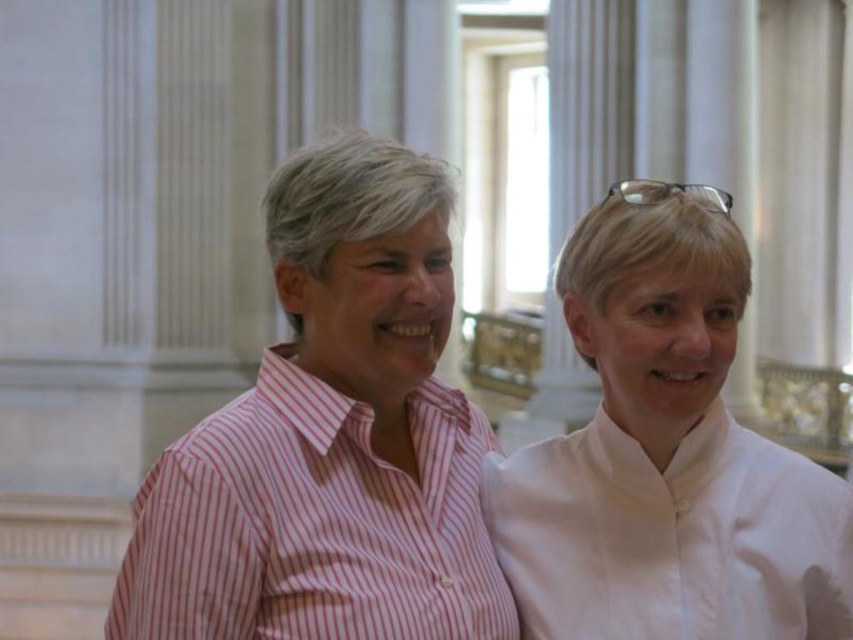
Does pink striped shirt at center have a smaller size compared to white smooth shirt at right?

No, pink striped shirt at center is not smaller than white smooth shirt at right.

Is pink striped shirt at center shorter than white smooth shirt at right?

No.

Which is in front, point (670, 300) or point (564, 314)?

Point (670, 300) is more forward.

I want to click on pink striped shirt at center, so click(x=664, y=458).

Can you confirm if pink striped shirt at center is smaller than pink striped shirt at left?

No, pink striped shirt at center is not smaller than pink striped shirt at left.

Can you confirm if pink striped shirt at center is wider than pink striped shirt at left?

Yes, pink striped shirt at center is wider than pink striped shirt at left.

Is point (527, 563) positioned in front of point (444, 428)?

Yes.

You are a GUI agent. You are given a task and a screenshot of the screen. Output one action in this format:
    pyautogui.click(x=<x>, y=<y>)
    Task: Click on the pink striped shirt at center
    
    Given the screenshot: What is the action you would take?
    pyautogui.click(x=664, y=458)

Between white smooth shirt at right and pink striped shirt at left, which one has more height?

white smooth shirt at right

Is white smooth shirt at right positioned in front of pink striped shirt at left?

No, it is not.

Image resolution: width=853 pixels, height=640 pixels. What are the coordinates of `white smooth shirt at right` in the screenshot? It's located at (665, 456).